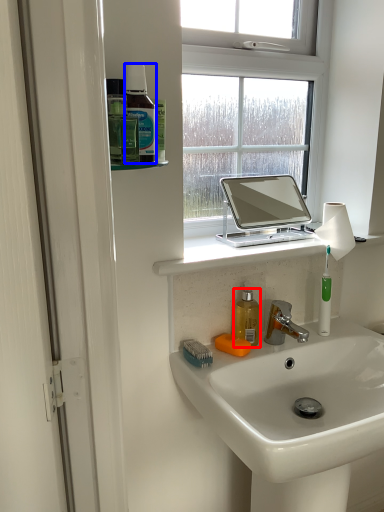
Question: Which point is further to the camera, mouthwash (highlighted by a red box) or mouthwash (highlighted by a blue box)?

Choices:
 (A) mouthwash
 (B) mouthwash

Answer: (A)